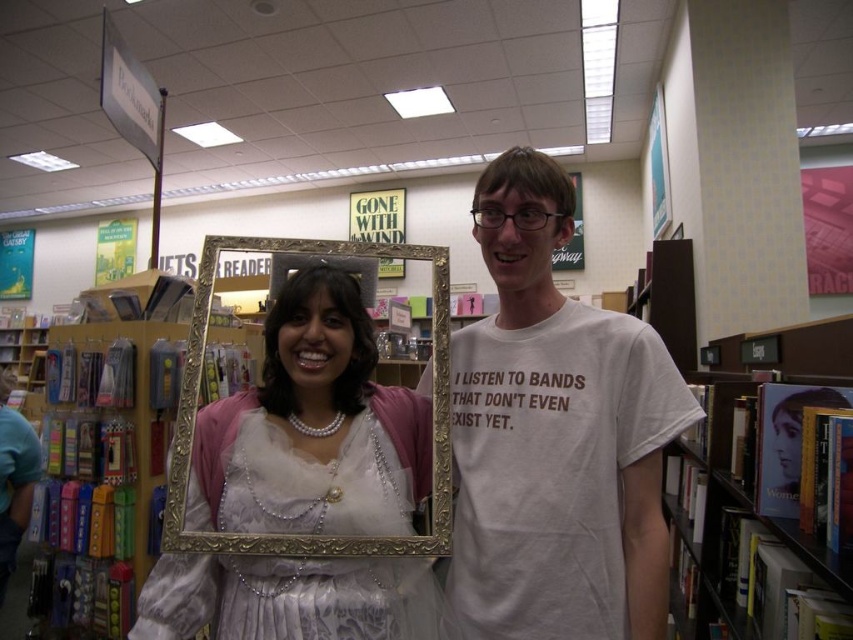
Is point (363, 376) less distant than point (746, 516)?

Yes.

Which of these two, white lace dress at center or hardcover book at center, stands shorter?

Standing shorter between the two is white lace dress at center.

Who is more distant from viewer, [329,618] or [813,573]?

The point [813,573] is behind.

You are a GUI agent. You are given a task and a screenshot of the screen. Output one action in this format:
    pyautogui.click(x=<x>, y=<y>)
    Task: Click on the white lace dress at center
    The height and width of the screenshot is (640, 853).
    Given the screenshot: What is the action you would take?
    pyautogui.click(x=312, y=428)

Which is in front, point (606, 403) or point (189, 282)?

Point (606, 403) is in front.

Which is below, white cotton t-shirt at center or wooden bookshelf at left?

wooden bookshelf at left is below.

Consider the image. Who is more forward, (514,156) or (172,352)?

Point (514,156) is in front.

Where is `white cotton t-shirt at center`? The image size is (853, 640). white cotton t-shirt at center is located at coordinates (555, 436).

Is white cotton t-shirt at center positioned behind white lace dress at center?

Yes, white cotton t-shirt at center is behind white lace dress at center.

Who is more forward, (x=599, y=376) or (x=270, y=339)?

Point (x=599, y=376) is in front.

The height and width of the screenshot is (640, 853). Find the location of `white cotton t-shirt at center`. white cotton t-shirt at center is located at coordinates (555, 436).